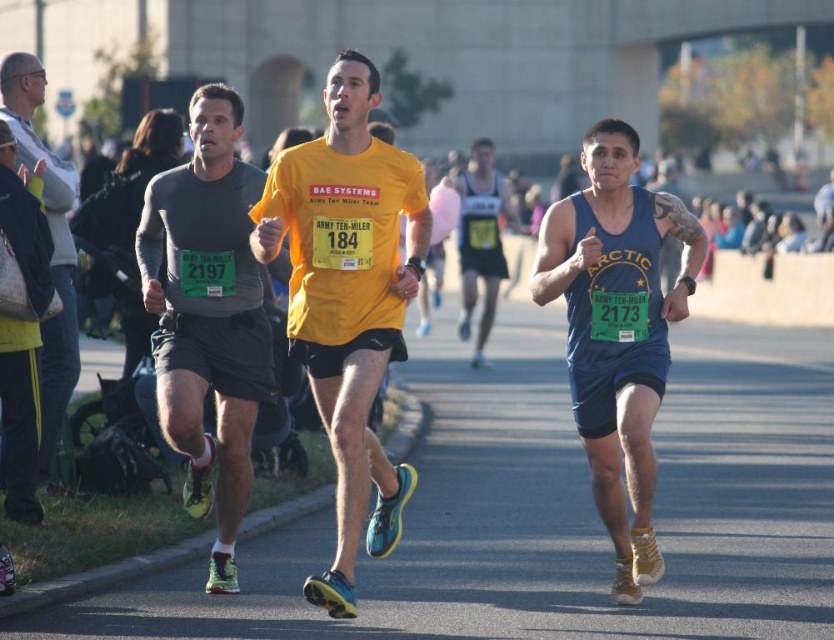
Question: Among these objects, which one is farthest from the camera?

Choices:
 (A) yellow matte shirt at center
 (B) matte blue tank top at center

Answer: (B)

Question: Can you confirm if yellow matte shirt at center is positioned below matte blue tank top at center?

Choices:
 (A) no
 (B) yes

Answer: (A)

Question: Can you confirm if yellow matte shirt at center is smaller than matte gray jacket at left?

Choices:
 (A) yes
 (B) no

Answer: (B)

Question: Is matte blue tank top at center to the right of matte gray jacket at left from the viewer's perspective?

Choices:
 (A) yes
 (B) no

Answer: (A)

Question: Which object appears closest to the camera in this image?

Choices:
 (A) matte gray jacket at left
 (B) matte gray long-sleeve shirt at left
 (C) yellow matte shirt at center
 (D) matte blue tank top at center

Answer: (C)

Question: Which object is positioned farthest from the yellow matte shirt at center?

Choices:
 (A) matte gray jacket at left
 (B) matte gray long-sleeve shirt at left
 (C) matte blue tank top at center

Answer: (A)